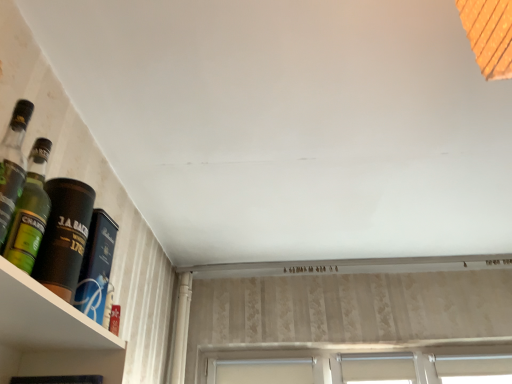
Question: Visually, is white fabric window at lower right, which appears as the 1th window when viewed from the right, positioned to the left or to the right of green glass bottle at left, positioned as the 1th bottle in front-to-back order?

Choices:
 (A) left
 (B) right

Answer: (B)

Question: Does point (453, 374) appear closer or farther from the camera than point (15, 231)?

Choices:
 (A) closer
 (B) farther

Answer: (B)

Question: Which of these objects is positioned farthest from the white fabric window at lower center, the second window viewed from the right?

Choices:
 (A) green glass bottle at left, marked as the 3th bottle in a back-to-front arrangement
 (B) white plastic window at center, marked as the first window in a left-to-right arrangement
 (C) dark brown leather bottle at left, the 1th bottle viewed from the back
 (D) white fabric window at lower right, which is the third window in left-to-right order
 (E) green glass bottle at left, arranged as the second bottle when viewed from the front

Answer: (A)

Question: Based on their relative distances, which object is farther from the white fabric window at lower right, which is the third window in left-to-right order?

Choices:
 (A) green glass bottle at left, arranged as the second bottle when viewed from the front
 (B) dark brown leather bottle at left, the 1th bottle viewed from the back
 (C) white fabric window at lower center, which is the second window in left-to-right order
 (D) white plastic window at center, which ranks as the 3th window in right-to-left order
 (E) green glass bottle at left, positioned as the 1th bottle in front-to-back order

Answer: (E)